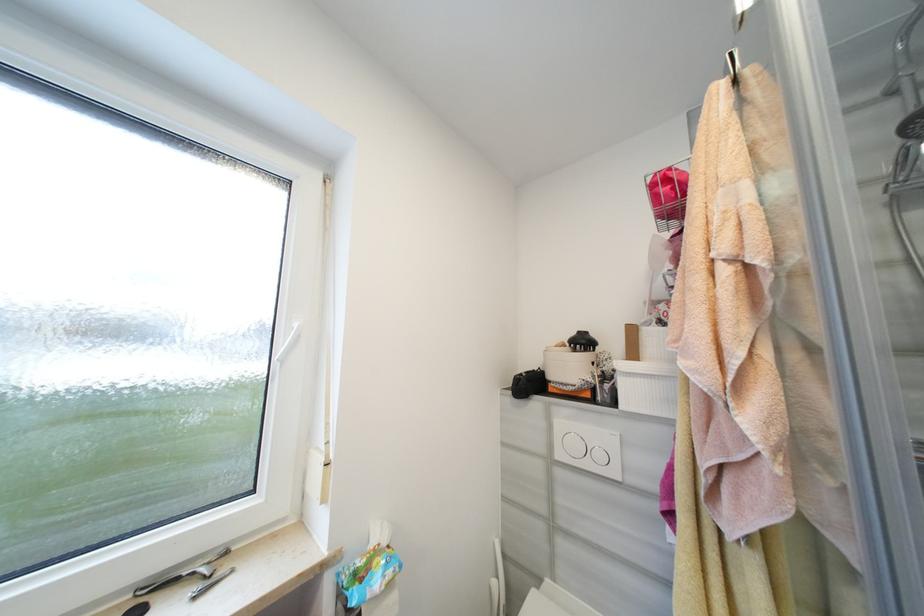
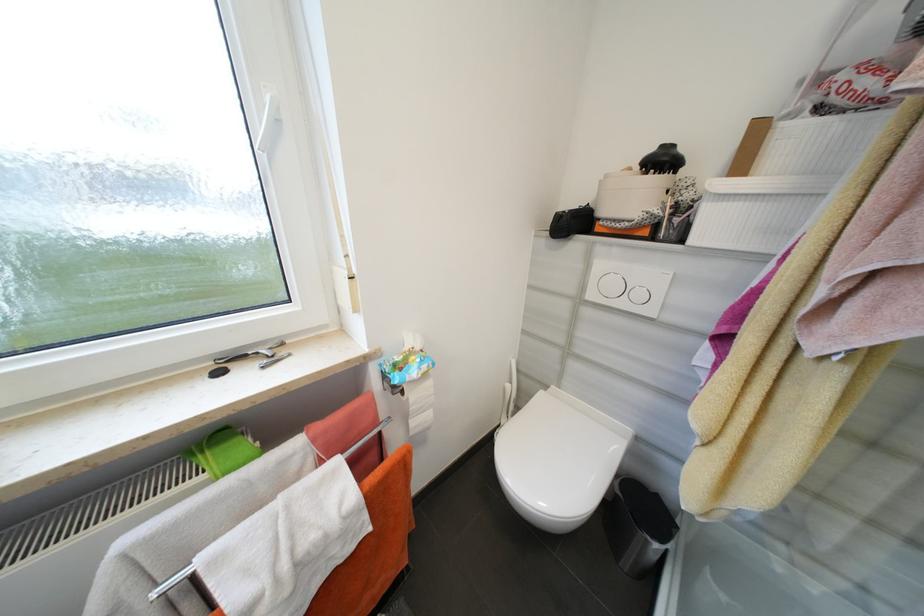
Locate, in the second image, the point that corresponds to pixel 544 583 in the first image.

(552, 387)